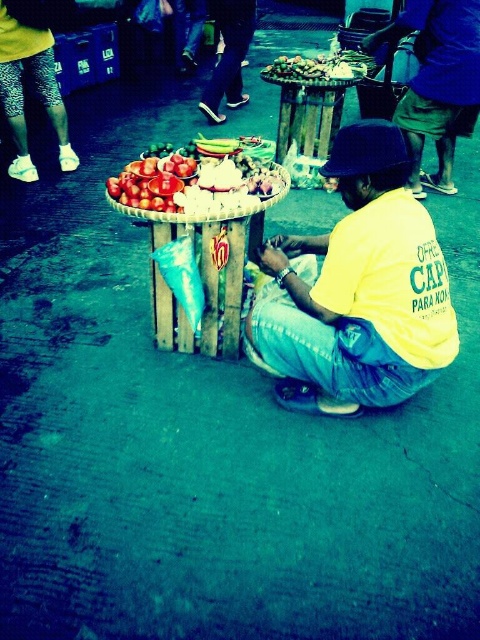
Consider the image. Who is higher up, yellow cotton shirt at center or wooden basket at center?

wooden basket at center is higher up.

This screenshot has width=480, height=640. What are the coordinates of `yellow cotton shirt at center` in the screenshot? It's located at (358, 291).

Locate an element on the screen. yellow cotton shirt at center is located at coordinates (358, 291).

Which is below, matte blue shirt at center or shiny red tomatoes at center?

shiny red tomatoes at center is below.

Is point (420, 150) farther from viewer compared to point (259, 176)?

Yes, point (420, 150) is farther from viewer.

Which is in front, point (459, 19) or point (236, 182)?

Point (236, 182) is more forward.

Where is `matte blue shirt at center`? This screenshot has height=640, width=480. matte blue shirt at center is located at coordinates (436, 83).

Between matte blue shirt at center and wooden basket at center, which one appears on the left side from the viewer's perspective?

Positioned to the left is wooden basket at center.

Based on the photo, does matte blue shirt at center have a lesser height compared to wooden basket at center?

Incorrect, matte blue shirt at center's height does not fall short of wooden basket at center's.

Does point (417, 177) lie in front of point (206, 336)?

No, (417, 177) is further to viewer.

This screenshot has width=480, height=640. Find the location of `matte blue shirt at center`. matte blue shirt at center is located at coordinates (436, 83).